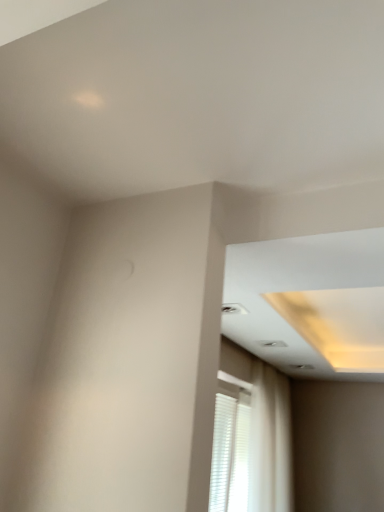
Question: Is white matte blinds at lower right far away from white sheer curtain at lower right?

Choices:
 (A) yes
 (B) no

Answer: (B)

Question: Does white matte blinds at lower right have a smaller size compared to white sheer curtain at lower right?

Choices:
 (A) yes
 (B) no

Answer: (A)

Question: From a real-world perspective, is white matte blinds at lower right positioned over white sheer curtain at lower right based on gravity?

Choices:
 (A) yes
 (B) no

Answer: (B)

Question: Is white matte blinds at lower right thinner than white sheer curtain at lower right?

Choices:
 (A) yes
 (B) no

Answer: (A)

Question: Is white matte blinds at lower right in front of white sheer curtain at lower right?

Choices:
 (A) no
 (B) yes

Answer: (B)

Question: Is white sheer curtain at lower right inside white matte blinds at lower right?

Choices:
 (A) yes
 (B) no

Answer: (B)

Question: Considering the relative sizes of white sheer curtain at lower right and white matte blinds at lower right in the image provided, is white sheer curtain at lower right wider than white matte blinds at lower right?

Choices:
 (A) no
 (B) yes

Answer: (B)

Question: Does white sheer curtain at lower right come in front of white matte blinds at lower right?

Choices:
 (A) yes
 (B) no

Answer: (B)

Question: From a real-world perspective, is white sheer curtain at lower right beneath white matte blinds at lower right?

Choices:
 (A) no
 (B) yes

Answer: (A)

Question: Is white sheer curtain at lower right placed right next to white matte blinds at lower right?

Choices:
 (A) yes
 (B) no

Answer: (B)

Question: Does white sheer curtain at lower right contain white matte blinds at lower right?

Choices:
 (A) yes
 (B) no

Answer: (B)

Question: Is white sheer curtain at lower right outside of white matte blinds at lower right?

Choices:
 (A) no
 (B) yes

Answer: (B)

Question: Is point (269, 465) closer or farther from the camera than point (243, 478)?

Choices:
 (A) farther
 (B) closer

Answer: (A)